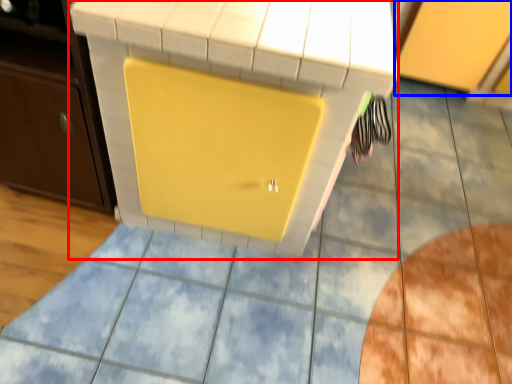
Question: Which point is closer to the camera, vanity (highlighted by a red box) or cabinetry (highlighted by a blue box)?

Choices:
 (A) vanity
 (B) cabinetry

Answer: (A)